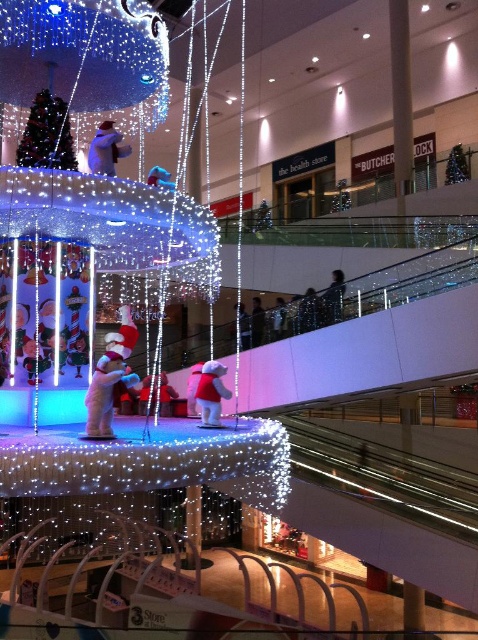
Question: Which point is farther to the camera?

Choices:
 (A) white plush bear at center
 (B) smooth skin person at upper right

Answer: (B)

Question: Is smooth skin person at center smaller than white plush bear at center?

Choices:
 (A) no
 (B) yes

Answer: (A)

Question: Is matte white santa at center thinner than smooth skin person at upper right?

Choices:
 (A) yes
 (B) no

Answer: (A)

Question: Among these objects, which one is farthest from the camera?

Choices:
 (A) matte red plush bear at center
 (B) matte white santa at center

Answer: (A)

Question: Which object is farther from the camera taking this photo?

Choices:
 (A) smooth skin person at upper right
 (B) matte white santa at center
 (C) white plush bear at center
 (D) smooth skin person at center

Answer: (A)

Question: Can you confirm if matte white santa at center is bigger than white plush bear at center?

Choices:
 (A) no
 (B) yes

Answer: (A)